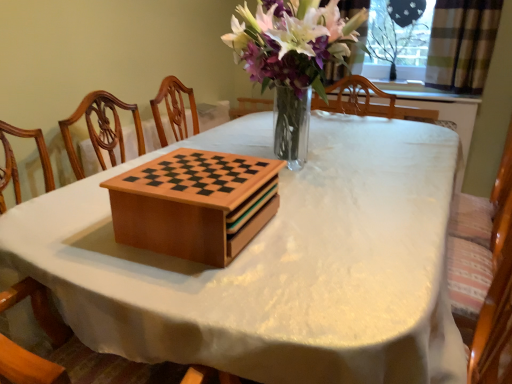
Question: Is wooden chess set at center thinner than wooden chessboard at center?

Choices:
 (A) yes
 (B) no

Answer: (B)

Question: From a real-world perspective, is wooden chess set at center below wooden chessboard at center?

Choices:
 (A) yes
 (B) no

Answer: (A)

Question: Considering the relative sizes of wooden chess set at center and wooden chessboard at center in the image provided, is wooden chess set at center smaller than wooden chessboard at center?

Choices:
 (A) yes
 (B) no

Answer: (B)

Question: Can you confirm if wooden chess set at center is positioned to the right of wooden chessboard at center?

Choices:
 (A) yes
 (B) no

Answer: (A)

Question: Does wooden chess set at center appear on the left side of wooden chessboard at center?

Choices:
 (A) yes
 (B) no

Answer: (B)

Question: From a real-world perspective, is wooden chess set at center physically above wooden chessboard at center?

Choices:
 (A) no
 (B) yes

Answer: (A)

Question: From the image's perspective, is wooden chessboard at center located above transparent plastic screen at upper right?

Choices:
 (A) yes
 (B) no

Answer: (B)

Question: Is transparent plastic screen at upper right surrounded by wooden chessboard at center?

Choices:
 (A) yes
 (B) no

Answer: (B)

Question: Does wooden chessboard at center come in front of transparent plastic screen at upper right?

Choices:
 (A) yes
 (B) no

Answer: (A)

Question: Is wooden chessboard at center to the right of transparent plastic screen at upper right from the viewer's perspective?

Choices:
 (A) yes
 (B) no

Answer: (B)

Question: Is wooden chessboard at center oriented towards transparent plastic screen at upper right?

Choices:
 (A) yes
 (B) no

Answer: (B)

Question: Is wooden chessboard at center positioned beyond the bounds of transparent plastic screen at upper right?

Choices:
 (A) no
 (B) yes

Answer: (B)

Question: Considering the relative sizes of wooden chessboard at center and plaid fabric curtain at upper right in the image provided, is wooden chessboard at center shorter than plaid fabric curtain at upper right?

Choices:
 (A) yes
 (B) no

Answer: (A)